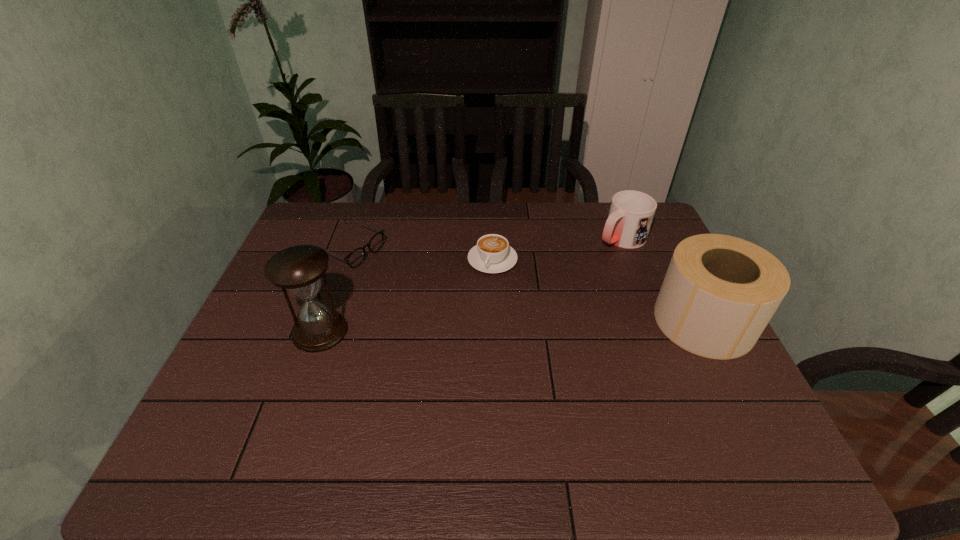
Identify the location of blank area in the image that satisfies the following two spatial constraints: 1. on the front side of the cappuccino; 2. on the left side of the spectacles. The image size is (960, 540). (342, 260).